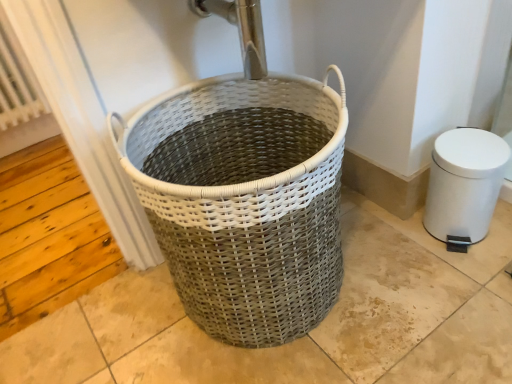
Question: Can we say white woven basket at center lies outside white textured radiator at left?

Choices:
 (A) no
 (B) yes

Answer: (B)

Question: Is the position of white woven basket at center less distant than that of white textured radiator at left?

Choices:
 (A) yes
 (B) no

Answer: (A)

Question: Can you confirm if white woven basket at center is positioned to the left of white textured radiator at left?

Choices:
 (A) yes
 (B) no

Answer: (B)

Question: Is white woven basket at center wider than white textured radiator at left?

Choices:
 (A) no
 (B) yes

Answer: (B)

Question: Considering the relative sizes of white woven basket at center and white textured radiator at left in the image provided, is white woven basket at center taller than white textured radiator at left?

Choices:
 (A) no
 (B) yes

Answer: (A)

Question: Can you confirm if white woven basket at center is smaller than white textured radiator at left?

Choices:
 (A) yes
 (B) no

Answer: (B)

Question: From the image's perspective, is white plastic bidet at right on top of white woven basket at center?

Choices:
 (A) no
 (B) yes

Answer: (B)

Question: Is white plastic bidet at right closer to the viewer compared to white woven basket at center?

Choices:
 (A) no
 (B) yes

Answer: (A)

Question: Could you tell me if white plastic bidet at right is turned towards white woven basket at center?

Choices:
 (A) yes
 (B) no

Answer: (B)

Question: Considering the relative sizes of white plastic bidet at right and white woven basket at center in the image provided, is white plastic bidet at right bigger than white woven basket at center?

Choices:
 (A) no
 (B) yes

Answer: (A)

Question: Is white plastic bidet at right to the left of white woven basket at center from the viewer's perspective?

Choices:
 (A) no
 (B) yes

Answer: (A)

Question: Does white plastic bidet at right come behind white woven basket at center?

Choices:
 (A) no
 (B) yes

Answer: (B)

Question: Is white textured radiator at left at the left side of white plastic bidet at right?

Choices:
 (A) yes
 (B) no

Answer: (A)